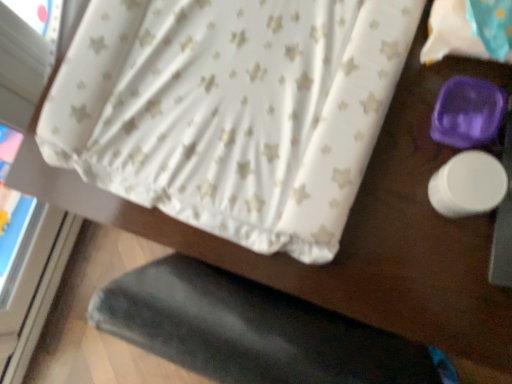
Question: Considering their positions, is white star-patterned fabric at upper right located in front of or behind white star-patterned fabric at upper center?

Choices:
 (A) behind
 (B) front

Answer: (B)

Question: From a real-world perspective, relative to white star-patterned fabric at upper center, is white star-patterned fabric at upper right vertically above or below?

Choices:
 (A) above
 (B) below

Answer: (A)

Question: Considering the relative positions of white star-patterned fabric at upper right and white star-patterned fabric at upper center in the image provided, is white star-patterned fabric at upper right to the left or to the right of white star-patterned fabric at upper center?

Choices:
 (A) right
 (B) left

Answer: (A)

Question: Is white star-patterned fabric at upper center in front of or behind white star-patterned fabric at upper right in the image?

Choices:
 (A) front
 (B) behind

Answer: (B)

Question: From the image's perspective, is white star-patterned fabric at upper center located above or below white star-patterned fabric at upper right?

Choices:
 (A) below
 (B) above

Answer: (A)

Question: From a real-world perspective, is white star-patterned fabric at upper center above or below white star-patterned fabric at upper right?

Choices:
 (A) below
 (B) above

Answer: (A)

Question: Looking at their shapes, would you say white star-patterned fabric at upper center is wider or thinner than white star-patterned fabric at upper right?

Choices:
 (A) wide
 (B) thin

Answer: (A)